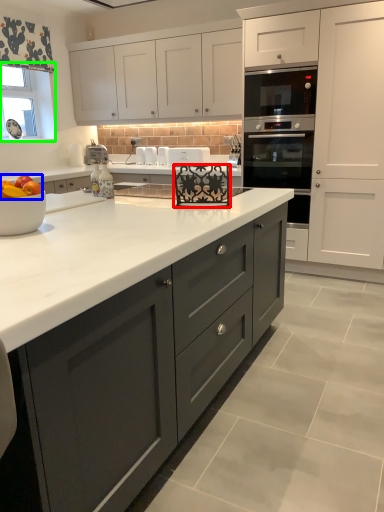
Question: Estimate the real-world distances between objects in this image. Which object is farther from appliance (highlighted by a red box), apple (highlighted by a blue box) or window screen (highlighted by a green box)?

Choices:
 (A) apple
 (B) window screen

Answer: (B)